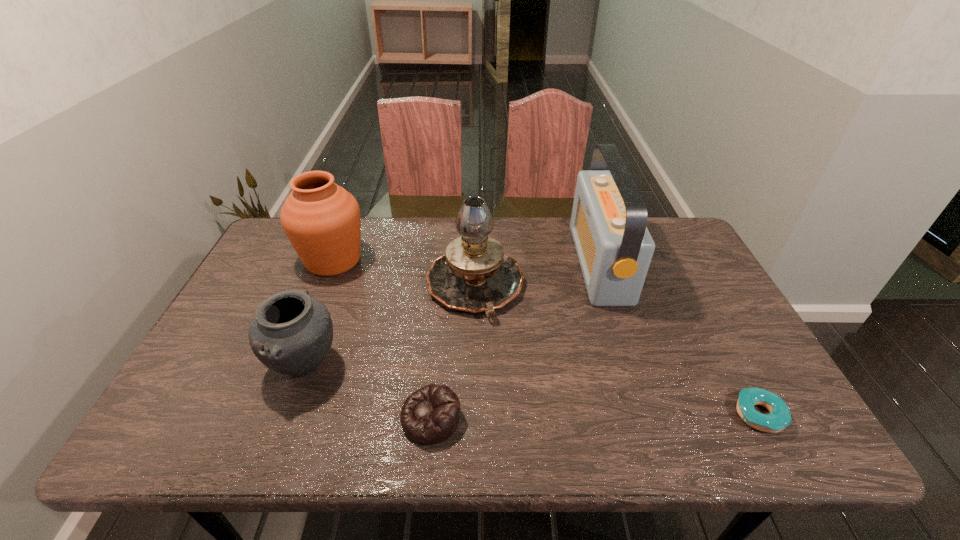
Where is `free space located 0.200m on the front-facing side of the second object from right to left`? Image resolution: width=960 pixels, height=540 pixels. free space located 0.200m on the front-facing side of the second object from right to left is located at coordinates (514, 264).

Find the location of a particular element. free point located 0.240m on the front of the farther urn is located at coordinates (299, 347).

In order to click on blank area located on the right of the oil lamp in this screenshot , I will do `click(600, 286)`.

Locate an element on the screen. free space located on the back of the third shortest object is located at coordinates (350, 242).

Locate an element on the screen. The height and width of the screenshot is (540, 960). free region located on the right of the beanbag is located at coordinates (497, 418).

At what (x,y) coordinates should I click in order to perform the action: click on vacant area situated on the back of the rightmost object. Please return your answer as a coordinate pair (x, y). This screenshot has width=960, height=540. Looking at the image, I should click on (726, 353).

This screenshot has width=960, height=540. In order to click on radio receiver that is at the far edge in this screenshot , I will do [x=608, y=223].

This screenshot has height=540, width=960. What are the coordinates of `urn situated at the far edge` in the screenshot? It's located at (322, 221).

At what (x,y) coordinates should I click in order to perform the action: click on oil lamp present at the far edge. Please return your answer as a coordinate pair (x, y). Looking at the image, I should click on (474, 275).

This screenshot has width=960, height=540. I want to click on beanbag that is at the near edge, so click(430, 415).